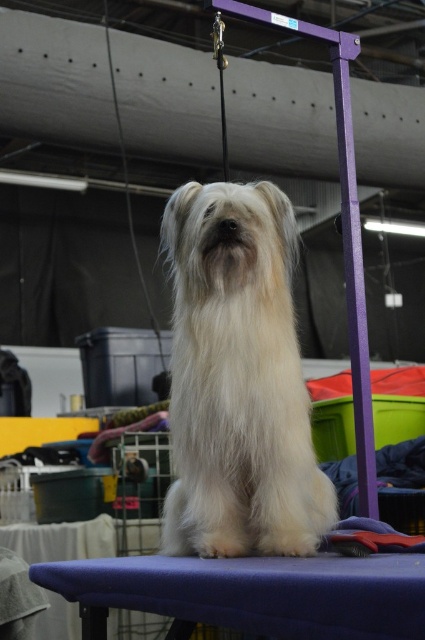
Question: Does white fluffy dog at center have a greater width compared to blue fabric stool at lower center?

Choices:
 (A) no
 (B) yes

Answer: (A)

Question: In this image, where is white fluffy dog at center located relative to blue fabric stool at lower center?

Choices:
 (A) right
 (B) left

Answer: (B)

Question: Which point is closer to the camera?

Choices:
 (A) (187, 298)
 (B) (218, 572)

Answer: (B)

Question: Is white fluffy dog at center to the left of blue fabric stool at lower center from the viewer's perspective?

Choices:
 (A) yes
 (B) no

Answer: (A)

Question: Which of the following is the farthest from the observer?

Choices:
 (A) [x=305, y=612]
 (B) [x=186, y=248]

Answer: (B)